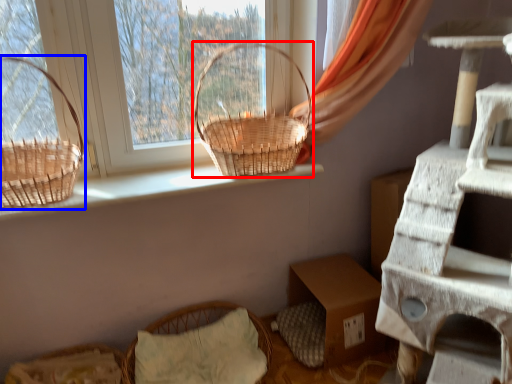
Question: Which object is closer to the camera taking this photo, picnic basket (highlighted by a red box) or picnic basket (highlighted by a blue box)?

Choices:
 (A) picnic basket
 (B) picnic basket

Answer: (B)